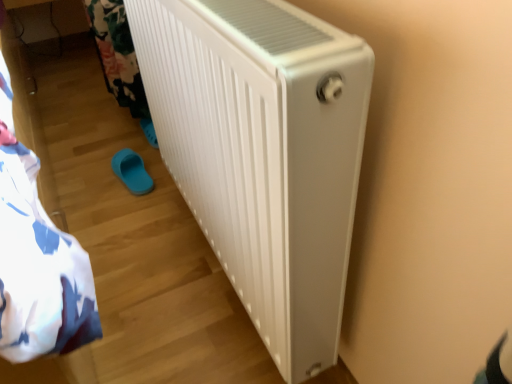
Question: From a real-world perspective, is blue rubber slipper at lower left positioned over white plastic radiator at center based on gravity?

Choices:
 (A) no
 (B) yes

Answer: (A)

Question: Is blue rubber slipper at lower left wider than white plastic radiator at center?

Choices:
 (A) no
 (B) yes

Answer: (A)

Question: From the image's perspective, would you say blue rubber slipper at lower left is positioned over white plastic radiator at center?

Choices:
 (A) no
 (B) yes

Answer: (A)

Question: Can you confirm if blue rubber slipper at lower left is positioned to the right of white plastic radiator at center?

Choices:
 (A) no
 (B) yes

Answer: (A)

Question: Is blue rubber slipper at lower left turned away from white plastic radiator at center?

Choices:
 (A) yes
 (B) no

Answer: (B)

Question: Can you confirm if blue rubber slipper at lower left is smaller than white plastic radiator at center?

Choices:
 (A) yes
 (B) no

Answer: (A)

Question: Is white plastic radiator at center placed right next to blue rubber slipper at lower left?

Choices:
 (A) yes
 (B) no

Answer: (B)

Question: From the image's perspective, is white plastic radiator at center over blue rubber slipper at lower left?

Choices:
 (A) yes
 (B) no

Answer: (A)

Question: Is white plastic radiator at center oriented away from blue rubber slipper at lower left?

Choices:
 (A) no
 (B) yes

Answer: (A)

Question: Can you confirm if white plastic radiator at center is bigger than blue rubber slipper at lower left?

Choices:
 (A) no
 (B) yes

Answer: (B)

Question: Can you confirm if white plastic radiator at center is thinner than blue rubber slipper at lower left?

Choices:
 (A) no
 (B) yes

Answer: (A)

Question: From the image's perspective, is white plastic radiator at center beneath blue rubber slipper at lower left?

Choices:
 (A) no
 (B) yes

Answer: (A)

Question: Is white plastic radiator at center to the left or to the right of blue rubber slipper at lower left in the image?

Choices:
 (A) right
 (B) left

Answer: (A)